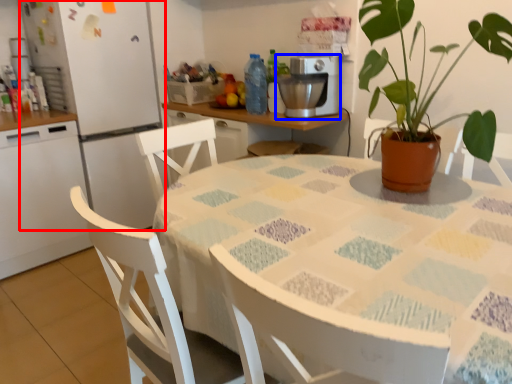
Question: Which object appears closest to the camera in this image, fridge (highlighted by a red box) or coffee machine (highlighted by a blue box)?

Choices:
 (A) fridge
 (B) coffee machine

Answer: (B)